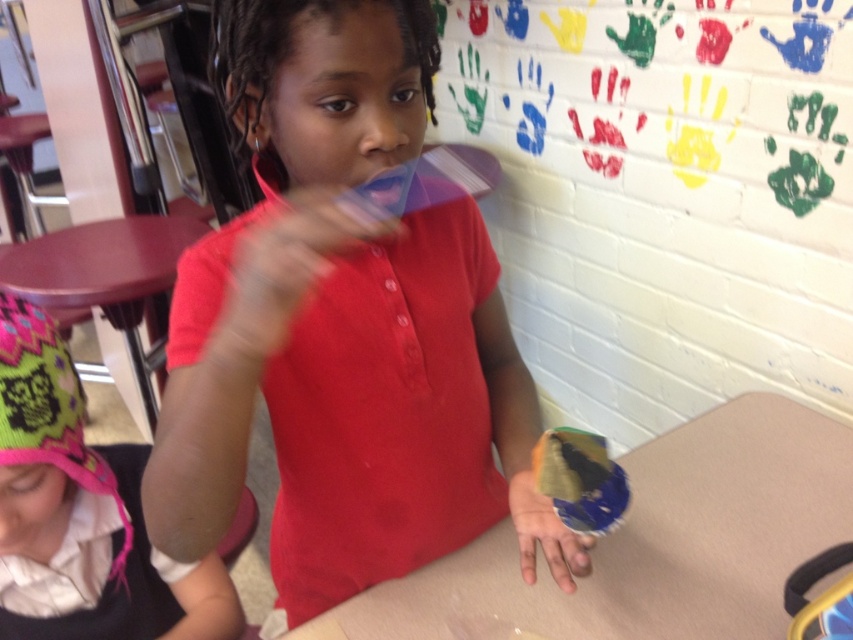
Does point (49, 289) lie behind point (561, 563)?

Yes, point (49, 289) is farther from viewer.

Who is taller, smooth brown table at lower left or smooth plastic hand at center?

smooth brown table at lower left is taller.

Is point (143, 253) positioned in front of point (569, 536)?

No.

The width and height of the screenshot is (853, 640). I want to click on smooth brown table at lower left, so click(105, 276).

Can you confirm if smooth brown table at lower left is wider than translucent plastic cup at center?

Correct, the width of smooth brown table at lower left exceeds that of translucent plastic cup at center.

In order to click on smooth brown table at lower left in this screenshot , I will do `click(105, 276)`.

At what (x,y) coordinates should I click in order to perform the action: click on smooth brown table at lower left. Please return your answer as a coordinate pair (x, y). This screenshot has height=640, width=853. Looking at the image, I should click on (105, 276).

Between pink knitted hat at lower left and translucent plastic cup at center, which one is positioned higher?

translucent plastic cup at center

Which of these two, pink knitted hat at lower left or translucent plastic cup at center, stands shorter?

translucent plastic cup at center

Find the location of `pink knitted hat at lower left`. pink knitted hat at lower left is located at coordinates (82, 512).